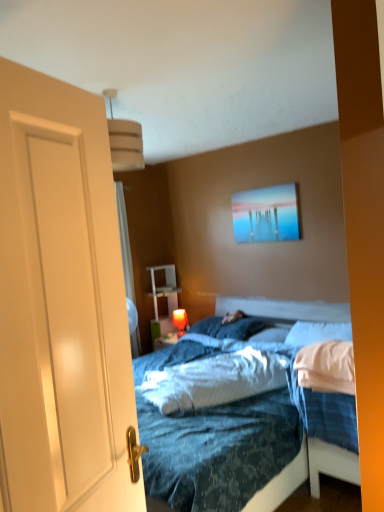
Question: From a real-world perspective, is matte orange lampshade at center on top of blue soft pillow at center, placed as the 2th pillow when sorted from right to left?

Choices:
 (A) yes
 (B) no

Answer: (B)

Question: Is matte orange lampshade at center aimed at blue soft pillow at center, placed as the 2th pillow when sorted from right to left?

Choices:
 (A) no
 (B) yes

Answer: (A)

Question: Are matte orange lampshade at center and blue soft pillow at center, placed as the 2th pillow when sorted from right to left, making contact?

Choices:
 (A) yes
 (B) no

Answer: (B)

Question: From a real-world perspective, is matte orange lampshade at center located beneath blue soft pillow at center, placed as the 2th pillow when sorted from right to left?

Choices:
 (A) no
 (B) yes

Answer: (B)

Question: From the image's perspective, is matte orange lampshade at center located beneath blue soft pillow at center, placed as the 2th pillow when sorted from right to left?

Choices:
 (A) no
 (B) yes

Answer: (B)

Question: From a real-world perspective, is metallic glossy picture frame at upper center above or below white matte door at left?

Choices:
 (A) below
 (B) above

Answer: (B)

Question: Is metallic glossy picture frame at upper center taller or shorter than white matte door at left?

Choices:
 (A) short
 (B) tall

Answer: (A)

Question: Is metallic glossy picture frame at upper center in front of or behind white matte door at left in the image?

Choices:
 (A) behind
 (B) front

Answer: (A)

Question: Looking at the image, does metallic glossy picture frame at upper center seem bigger or smaller compared to white matte door at left?

Choices:
 (A) small
 (B) big

Answer: (A)

Question: Based on their sizes in the image, would you say blue textured mattress at center is bigger or smaller than wooden bed frame at center?

Choices:
 (A) small
 (B) big

Answer: (A)

Question: Relative to wooden bed frame at center, is blue textured mattress at center in front or behind?

Choices:
 (A) front
 (B) behind

Answer: (B)

Question: From the image's perspective, is blue textured mattress at center located above or below wooden bed frame at center?

Choices:
 (A) above
 (B) below

Answer: (B)

Question: Considering the relative positions of blue textured mattress at center and wooden bed frame at center in the image provided, is blue textured mattress at center to the left or to the right of wooden bed frame at center?

Choices:
 (A) left
 (B) right

Answer: (A)

Question: In terms of size, does white soft pillow at right, which is the third pillow in left-to-right order, appear bigger or smaller than blue soft pillow at center, placed as the 2th pillow when sorted from right to left?

Choices:
 (A) small
 (B) big

Answer: (B)

Question: Do you think white soft pillow at right, which is the third pillow in left-to-right order, is within blue soft pillow at center, placed as the 2th pillow when sorted from right to left, or outside of it?

Choices:
 (A) outside
 (B) inside

Answer: (A)